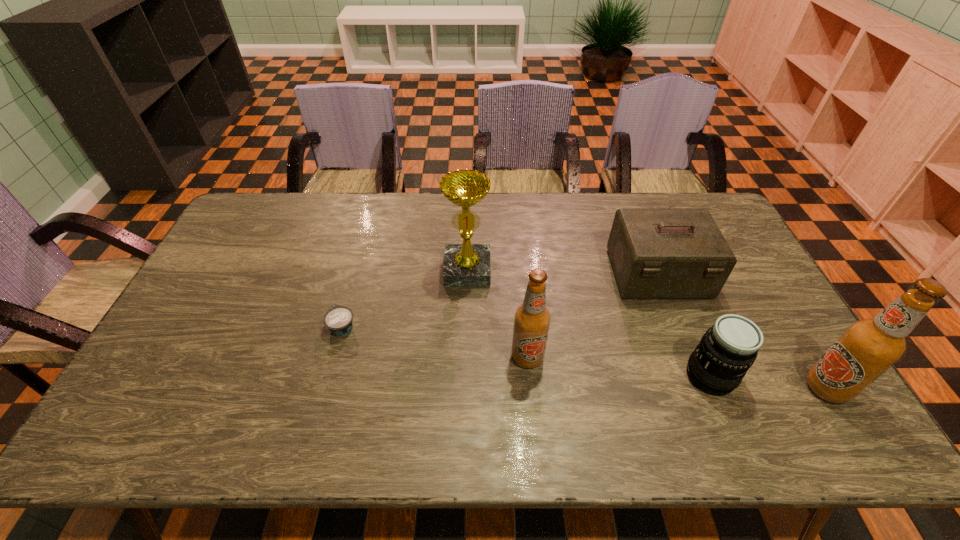
What are the coordinates of `object that is at the near right corner` in the screenshot? It's located at (868, 347).

Where is `vacant region at the far edge of the desktop`? This screenshot has width=960, height=540. vacant region at the far edge of the desktop is located at coordinates (455, 221).

In the image, there is a desktop. Where is `free region at the near edge`? This screenshot has height=540, width=960. free region at the near edge is located at coordinates (419, 401).

Identify the location of vacant area at the left edge of the desktop. The width and height of the screenshot is (960, 540). (202, 287).

In the image, there is a desktop. Where is `free space at the far left corner`? The height and width of the screenshot is (540, 960). free space at the far left corner is located at coordinates (244, 210).

In the image, there is a desktop. In order to click on vacant region at the near left corner in this screenshot , I will do `click(180, 386)`.

This screenshot has height=540, width=960. Find the location of `vacant area between the taller beer bottle and the shortest object`. vacant area between the taller beer bottle and the shortest object is located at coordinates click(x=585, y=357).

The width and height of the screenshot is (960, 540). I want to click on free point between the first-aid kit and the telephoto lens, so click(x=684, y=325).

Locate an element on the screen. This screenshot has height=540, width=960. free space that is in between the first-aid kit and the award is located at coordinates (563, 272).

Where is `empty space between the rightmost object and the second object from left to right`? The height and width of the screenshot is (540, 960). empty space between the rightmost object and the second object from left to right is located at coordinates (647, 329).